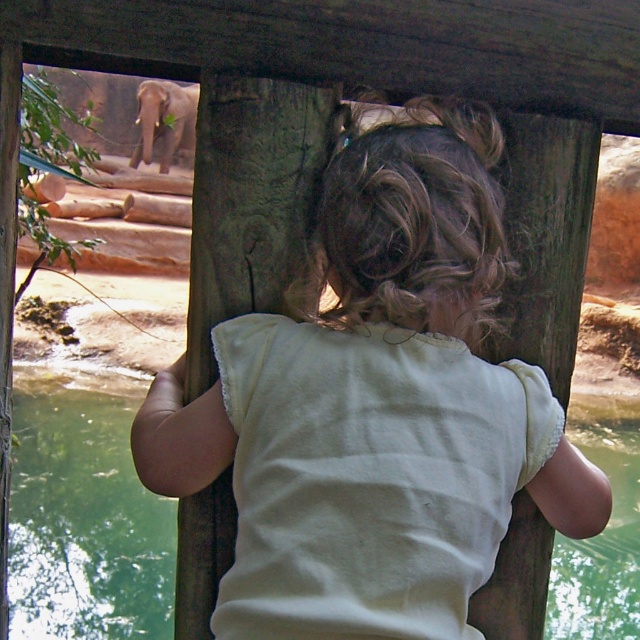
You are standing at the viewing platform and see the point marked at coordinates (83,524). Based on the scene, what is the location of this point relative to the green liquid water at lower center?

The point marked at coordinates (83,524) is located on the green liquid water at lower center.

You are a visitor at the zoo and want to take a photo of the light yellow fabric at center and the gray textured elephant at upper left in the same frame. The camera you have can capture objects up to 20 meters apart. Will both objects fit in the frame?

The light yellow fabric at center is 19.93 meters from the gray textured elephant at upper left, so yes, both objects will fit in the frame since the distance is within the camera range.

In the scene shown: What is the color of the object located at the coordinates point (381, 337)?

The object located at point (381, 337) is light yellow fabric at center.